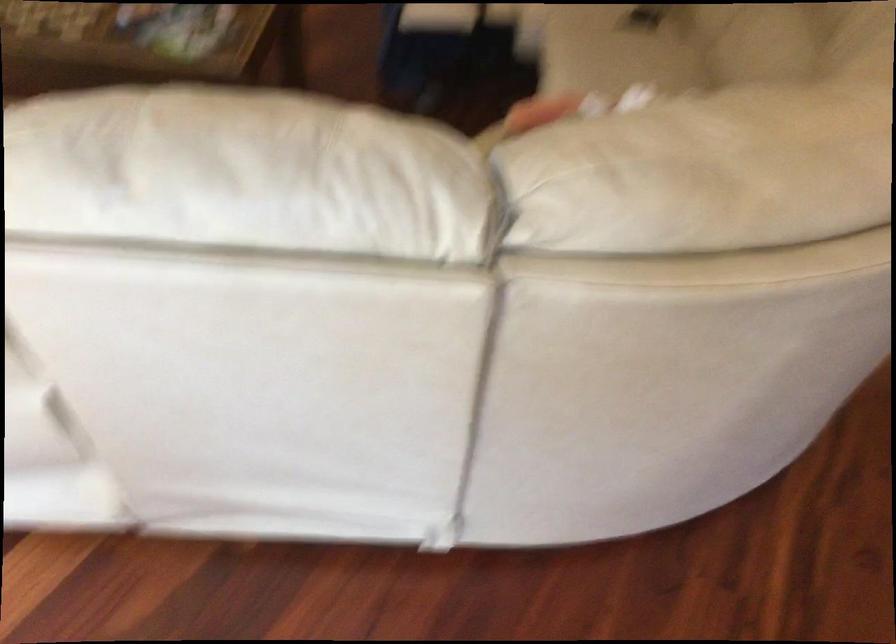
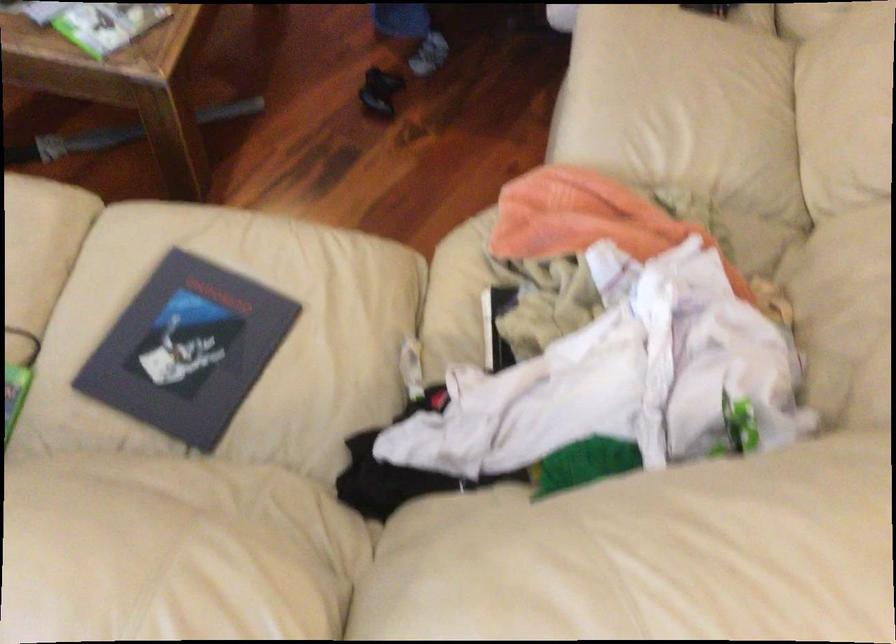
Question: The first image is from the beginning of the video and the second image is from the end. How did the camera likely rotate when shooting the video?

Choices:
 (A) Left
 (B) Right
 (C) Up
 (D) Down

Answer: (D)